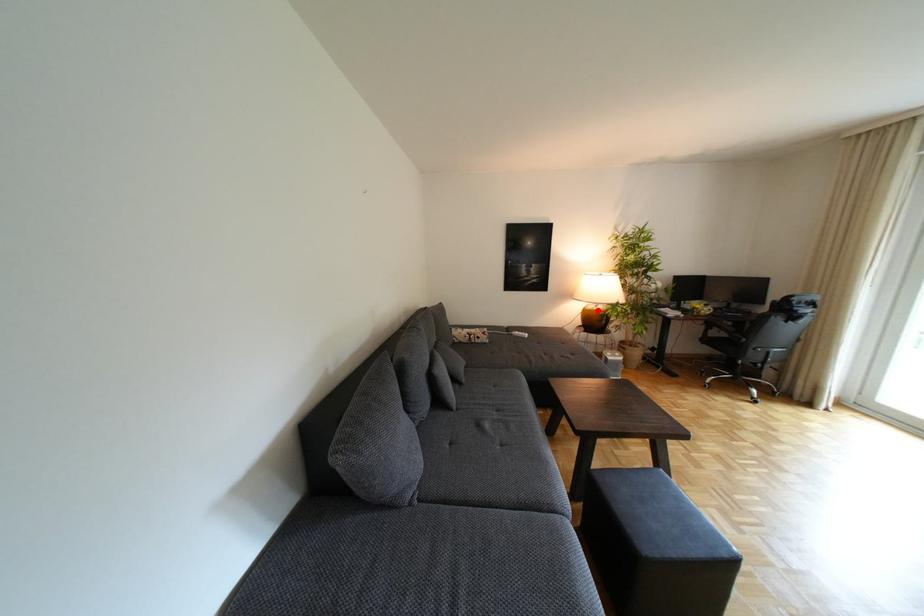
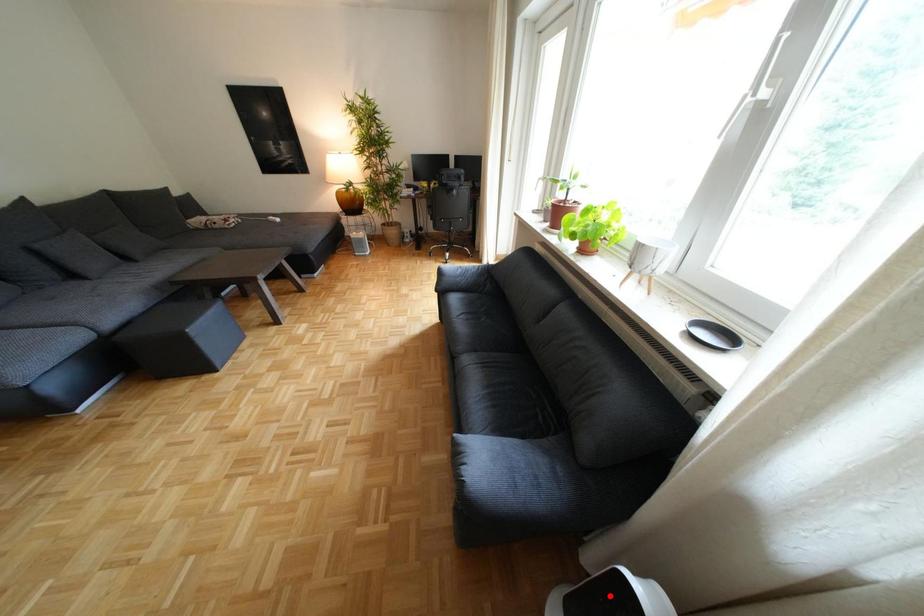
I am providing you with two images of the same scene from different viewpoints. A red point is marked on the first image and another point is marked on the second image. Are the points marked in image1 and image2 representing the same 3D position?

No